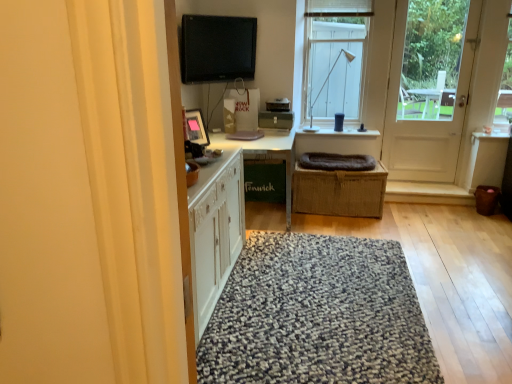
Question: From the image's perspective, relative to textured gray rug at center, is white glass window at upper center above or below?

Choices:
 (A) above
 (B) below

Answer: (A)

Question: Looking at their shapes, would you say white glass window at upper center is wider or thinner than textured gray rug at center?

Choices:
 (A) thin
 (B) wide

Answer: (A)

Question: Which of these objects is positioned closest to the matte black lamp at upper center?

Choices:
 (A) black glossy computer monitor at upper center
 (B) textured gray rug at center
 (C) white glossy table at center
 (D) white glass window at upper center
 (E) white wooden door at right

Answer: (D)

Question: Which is nearer to the white wooden door at right?

Choices:
 (A) black glossy computer monitor at upper center
 (B) textured gray rug at center
 (C) matte black lamp at upper center
 (D) white glossy table at center
 (E) white glass window at upper center

Answer: (E)